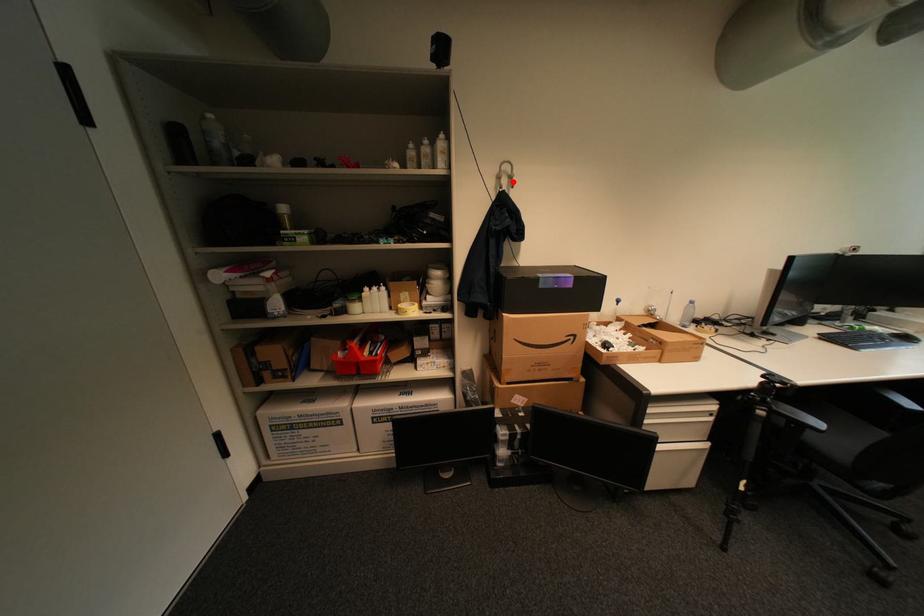
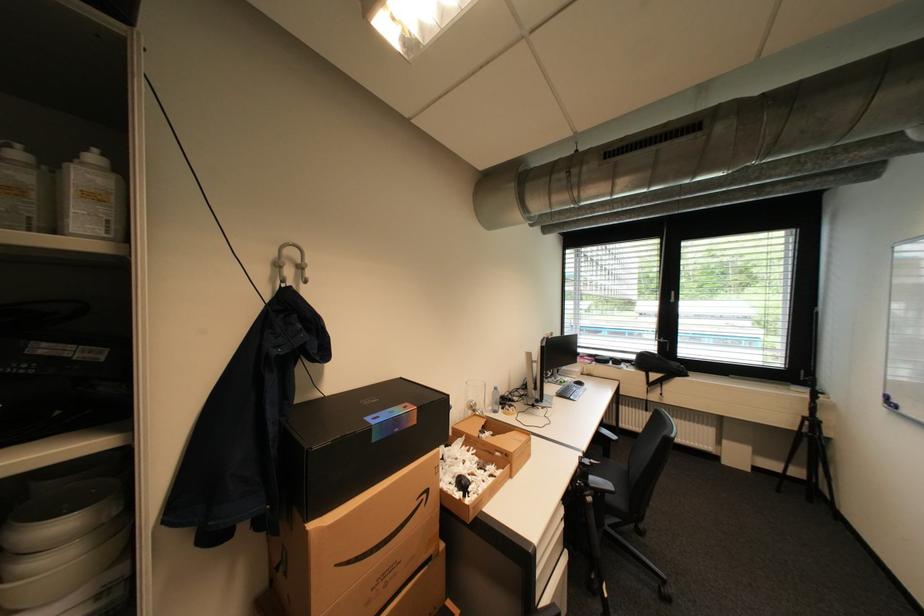
Question: I am providing you with two images of the same scene from different viewpoints. Image1 has a red point marked. In image2, the corresponding 3D location appears at what relative position? Reply with the corresponding letter.

Choices:
 (A) Closer
 (B) Farther

Answer: (B)